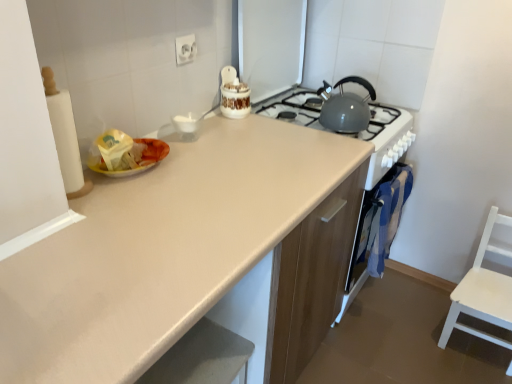
Question: From a real-world perspective, is matte beige countertop at center physically below white wood chair at right?

Choices:
 (A) yes
 (B) no

Answer: (B)

Question: Is matte beige countertop at center positioned far away from white wood chair at right?

Choices:
 (A) no
 (B) yes

Answer: (B)

Question: Can you confirm if matte beige countertop at center is thinner than white wood chair at right?

Choices:
 (A) no
 (B) yes

Answer: (A)

Question: Considering the relative sizes of matte beige countertop at center and white wood chair at right in the image provided, is matte beige countertop at center bigger than white wood chair at right?

Choices:
 (A) no
 (B) yes

Answer: (B)

Question: Can you confirm if matte beige countertop at center is taller than white wood chair at right?

Choices:
 (A) no
 (B) yes

Answer: (B)

Question: Is point tap(364, 206) positioned closer to the camera than point tap(185, 51)?

Choices:
 (A) closer
 (B) farther

Answer: (B)

Question: From a real-world perspective, relative to white plastic electric outlet at upper center, is blue fabric oven at right vertically above or below?

Choices:
 (A) above
 (B) below

Answer: (B)

Question: From the image's perspective, relative to white plastic electric outlet at upper center, is blue fabric oven at right above or below?

Choices:
 (A) below
 (B) above

Answer: (A)

Question: In terms of height, does blue fabric oven at right look taller or shorter compared to white plastic electric outlet at upper center?

Choices:
 (A) short
 (B) tall

Answer: (B)

Question: From the image's perspective, is blue fabric oven at right positioned above or below matte gray kettle at upper right?

Choices:
 (A) above
 (B) below

Answer: (B)

Question: Is blue fabric oven at right bigger or smaller than matte gray kettle at upper right?

Choices:
 (A) big
 (B) small

Answer: (A)

Question: In terms of width, does blue fabric oven at right look wider or thinner when compared to matte gray kettle at upper right?

Choices:
 (A) thin
 (B) wide

Answer: (A)

Question: Is blue fabric oven at right in front of or behind matte gray kettle at upper right in the image?

Choices:
 (A) front
 (B) behind

Answer: (B)

Question: Would you say matte beige countertop at center is inside or outside white wood chair at right?

Choices:
 (A) outside
 (B) inside

Answer: (A)

Question: From the image's perspective, is matte beige countertop at center positioned above or below white wood chair at right?

Choices:
 (A) below
 (B) above

Answer: (B)